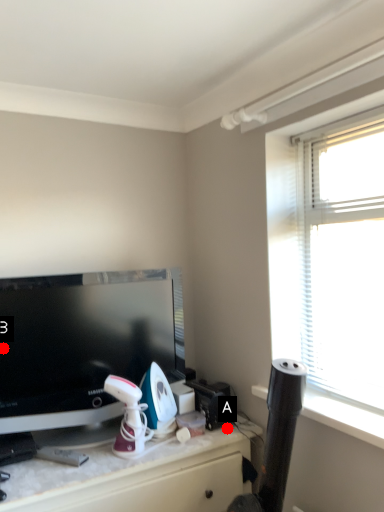
Question: Two points are circled on the image, labeled by A and B beside each circle. Which point appears closest to the camera in this image?

Choices:
 (A) A is closer
 (B) B is closer

Answer: (B)